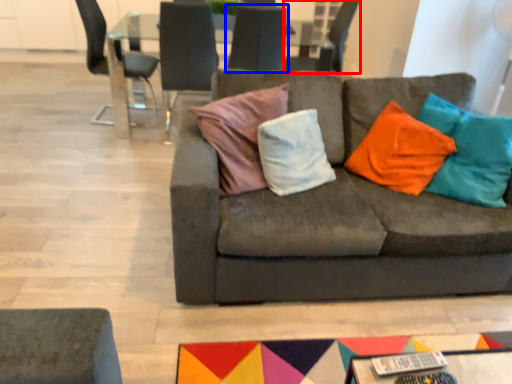
Question: Which object appears farthest to the camera in this image, chair (highlighted by a red box) or chair (highlighted by a blue box)?

Choices:
 (A) chair
 (B) chair

Answer: (A)